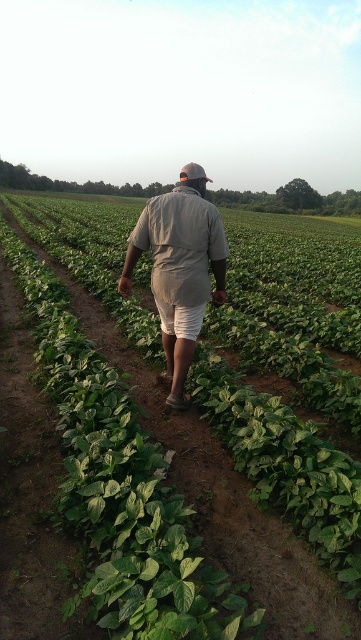
You are a photographer trying to capture a photo of the khaki fabric shirt at center while focusing on the green leafy plant at center. Can you focus on both objects at the same time?

The green leafy plant at center is closer to the viewer than the khaki fabric shirt at center. Since they are at different distances, it might be challenging to focus on both simultaneously in a single photo.

You are standing in the middle of a farm field and see a person walking along a dirt path. You notice a green leafy plant at center and a khaki fabric shirt at center. Which object is positioned to the left from your perspective?

The green leafy plant at center is to the left of the khaki fabric shirt at center.